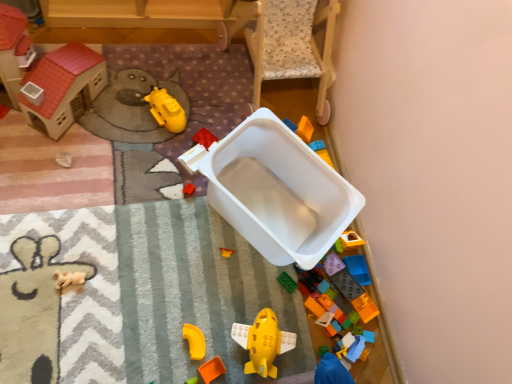
Question: Considering the positions of matte plastic toy house at lower right, positioned as the 9th toy in left-to-right order, and green matte toy at lower right, which is the fourth toy in right-to-left order, in the image, is matte plastic toy house at lower right, positioned as the 9th toy in left-to-right order, bigger or smaller than green matte toy at lower right, which is the fourth toy in right-to-left order,?

Choices:
 (A) big
 (B) small

Answer: (A)

Question: From the image's perspective, relative to green matte toy at lower right, the eighth toy positioned from the left, is matte plastic toy house at lower right, positioned as the 9th toy in left-to-right order, above or below?

Choices:
 (A) above
 (B) below

Answer: (A)

Question: Estimate the real-world distances between objects in this image. Which object is farther from the white plastic container at center, the 9th toy from the right?

Choices:
 (A) bright orange plastic blocks at lower right, which is the eleventh toy from left to right
 (B) yellow plastic curve at lower center, arranged as the 8th toy when viewed from the right
 (C) yellow plastic submarine at upper center, acting as the 2th toy starting from the left
 (D) orange plastic toy at lower center, which ranks as the 6th toy in right-to-left order
 (E) rubber brick at center, positioned as the fifth toy in left-to-right order

Answer: (A)

Question: Which is farther from the white plastic container at center?

Choices:
 (A) wooden house at upper left, the 1th toy positioned from the left
 (B) rubber brick at center, acting as the seventh toy starting from the right
 (C) orange plastic toy at lower center, which ranks as the 6th toy in right-to-left order
 (D) green matte toy at lower right, which is the fourth toy in right-to-left order
 (E) yellow plastic airplane at center, placed as the 7th toy when sorted from left to right

Answer: (A)